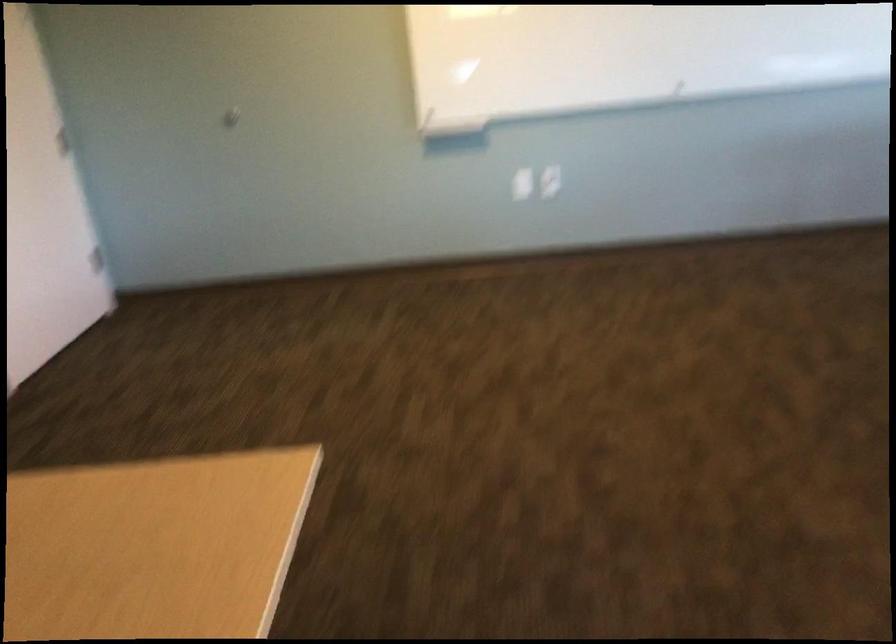
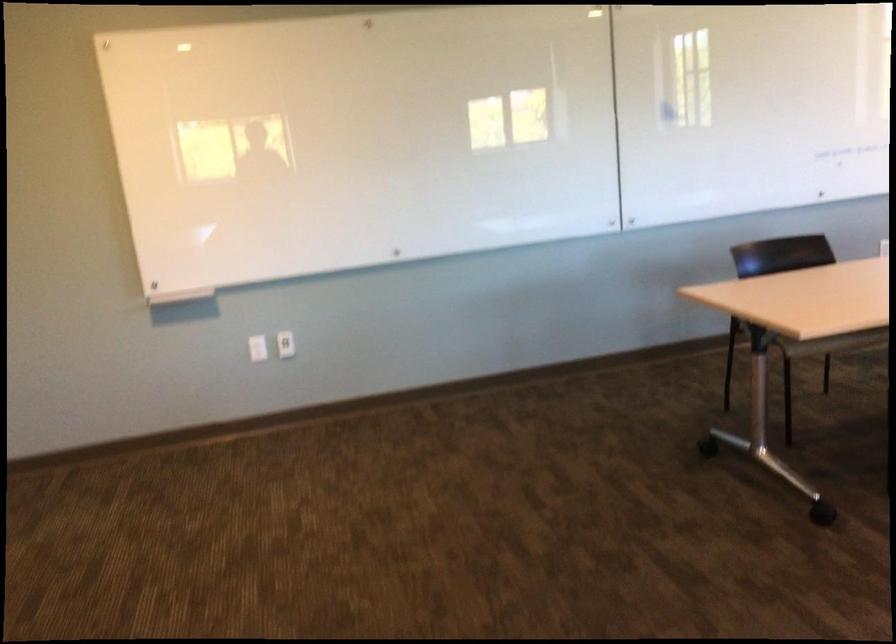
Find the pixel in the second image that matches [547,183] in the first image.

(286, 344)